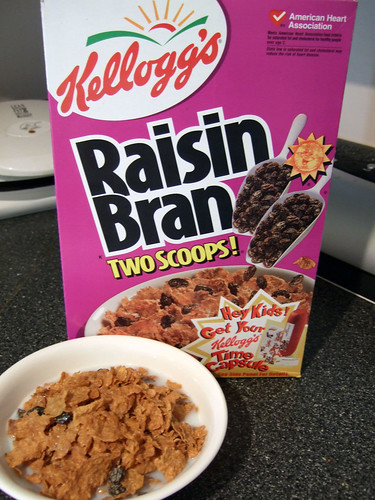
Find the location of `plate`. plate is located at coordinates (119, 356).